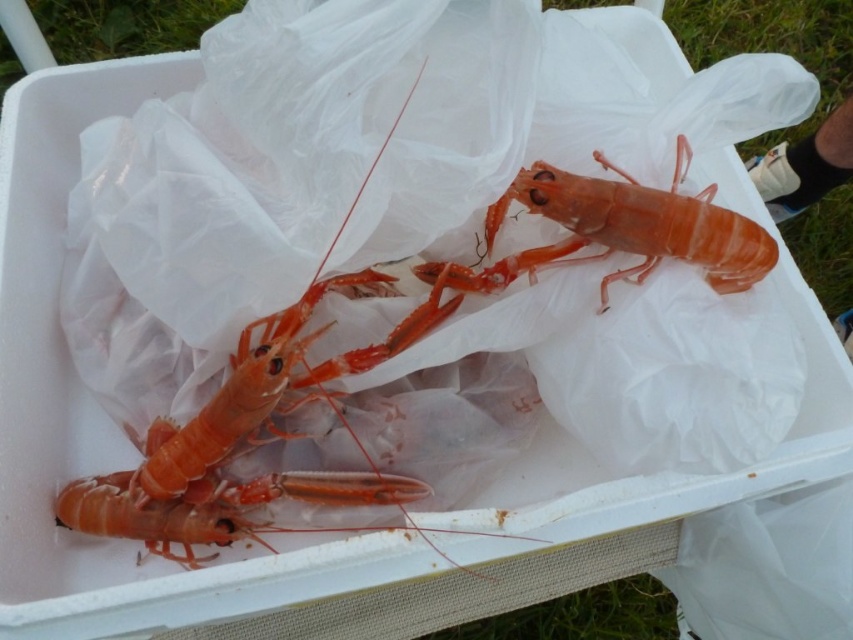
You are a photographer trying to capture a closeup shot of the shiny orange lobster at center. Your camera lens has a minimum focusing distance of 24 inches. Can you take the photo without moving the cooler?

The shiny orange lobster at center is 25.38 inches away from the camera. Since the minimum focusing distance is 24 inches, the camera can focus on the shiny orange lobster at center as it is beyond the minimum distance required.

You are a biologist measuring the distance between two lobsters in a cooler. The cooler has a 10 inch wide opening. Can you safely reach both the shiny orange lobster at center and the translucent orange lobster at center through the opening without moving the cooler?

The shiny orange lobster at center is 8.13 inches away from the translucent orange lobster at center. Since the distance between them is less than the 10 inch opening, you can safely reach both lobsters through the opening without moving the cooler.

You are a chef preparing to cook a seafood dish and need to choose between two lobsters in a cooler. You notice the shiny orange lobster at center and the translucent orange lobster at center. Which lobster is located beneath the other one?

The shiny orange lobster at center is positioned under the translucent orange lobster at center, so it is located beneath the other one.